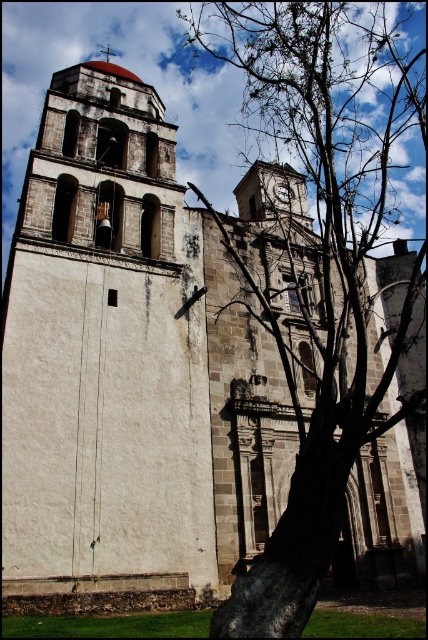
Which is more to the left, white stone bell tower at center or metallic clock at center?

white stone bell tower at center

Measure the distance between point [101,90] and camera.

A distance of 62.61 meters exists between point [101,90] and camera.

The image size is (428, 640). Identify the location of white stone bell tower at center. (104, 353).

Is brown bark tree at center to the left of metallic clock at center from the viewer's perspective?

Incorrect, brown bark tree at center is not on the left side of metallic clock at center.

Between point (359, 355) and point (276, 192), which one is positioned in front?

Point (359, 355) is more forward.

The image size is (428, 640). I want to click on brown bark tree at center, so (x=323, y=262).

Is white stone bell tower at center bigger than brown bark tree at center?

No, white stone bell tower at center is not bigger than brown bark tree at center.

Which is in front, point (2, 548) or point (198, 22)?

Point (2, 548)

Is point (158, 476) farther from viewer compared to point (362, 262)?

No, (158, 476) is in front of (362, 262).

You are a GUI agent. You are given a task and a screenshot of the screen. Output one action in this format:
    pyautogui.click(x=<x>, y=<y>)
    Task: Click on the white stone bell tower at center
    
    Given the screenshot: What is the action you would take?
    [x=104, y=353]